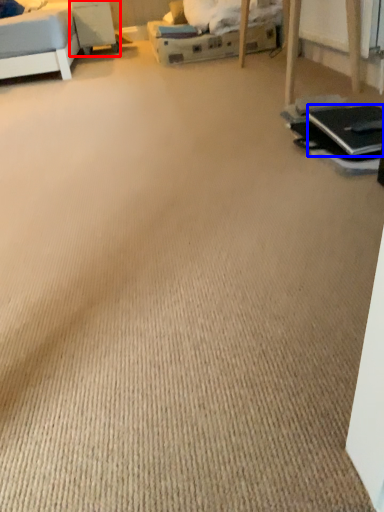
Question: Which object appears closest to the camera in this image, table (highlighted by a red box) or laptop (highlighted by a blue box)?

Choices:
 (A) table
 (B) laptop

Answer: (B)